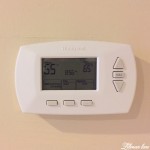
Identify the location of blurry image of thermostat. (111, 60).